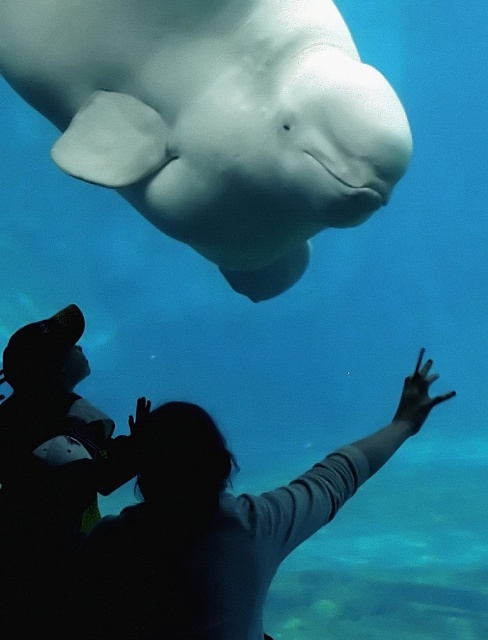
Does white smooth whale at upper center appear under silhouette fabric at center?

Actually, white smooth whale at upper center is above silhouette fabric at center.

You are a GUI agent. You are given a task and a screenshot of the screen. Output one action in this format:
    pyautogui.click(x=<x>, y=<y>)
    Task: Click on the white smooth whale at upper center
    
    Given the screenshot: What is the action you would take?
    pyautogui.click(x=215, y=120)

At what (x,y) coordinates should I click in order to perform the action: click on white smooth whale at upper center. Please return your answer as a coordinate pair (x, y). Looking at the image, I should click on (215, 120).